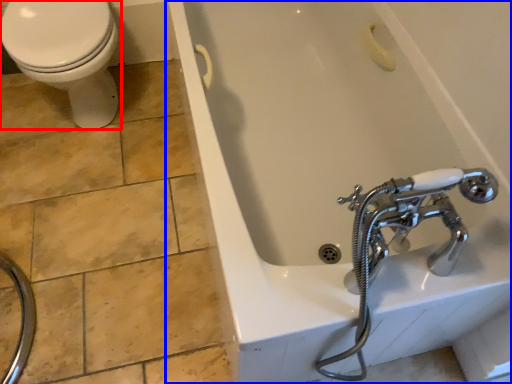
Question: Which object appears farthest to the camera in this image, bidet (highlighted by a red box) or bathtub (highlighted by a blue box)?

Choices:
 (A) bidet
 (B) bathtub

Answer: (A)